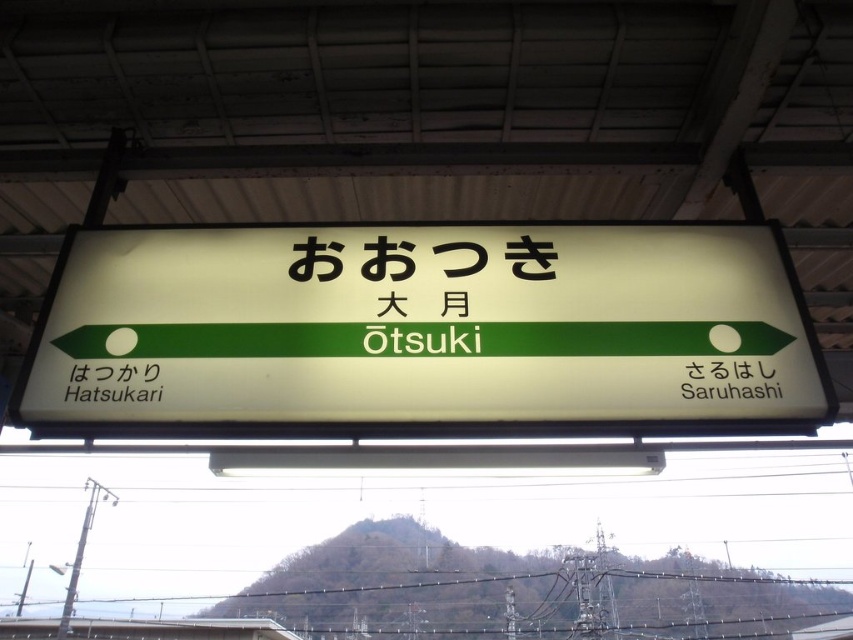
Between white plastic sign at center and black plastic sign at upper center, which one has more height?

Standing taller between the two is white plastic sign at center.

Does white plastic sign at center come in front of black plastic sign at upper center?

Yes, white plastic sign at center is closer to the viewer.

Find the location of a particular element. This screenshot has width=853, height=640. white plastic sign at center is located at coordinates (422, 326).

The width and height of the screenshot is (853, 640). In order to click on white plastic sign at center in this screenshot , I will do `click(422, 326)`.

Between white plastic sign at center and white paper at lower left, which one appears on the left side from the viewer's perspective?

white paper at lower left

Image resolution: width=853 pixels, height=640 pixels. What do you see at coordinates (422, 326) in the screenshot?
I see `white plastic sign at center` at bounding box center [422, 326].

Where is `white plastic sign at center`? The width and height of the screenshot is (853, 640). white plastic sign at center is located at coordinates (422, 326).

Can you confirm if white paper at lower left is positioned to the right of black plastic sign at upper center?

No, white paper at lower left is not to the right of black plastic sign at upper center.

Does white paper at lower left have a greater height compared to black plastic sign at upper center?

No.

Where is `white paper at lower left`? The image size is (853, 640). white paper at lower left is located at coordinates (113, 381).

At what (x,y) coordinates should I click in order to perform the action: click on white paper at lower left. Please return your answer as a coordinate pair (x, y). Looking at the image, I should click on (113, 381).